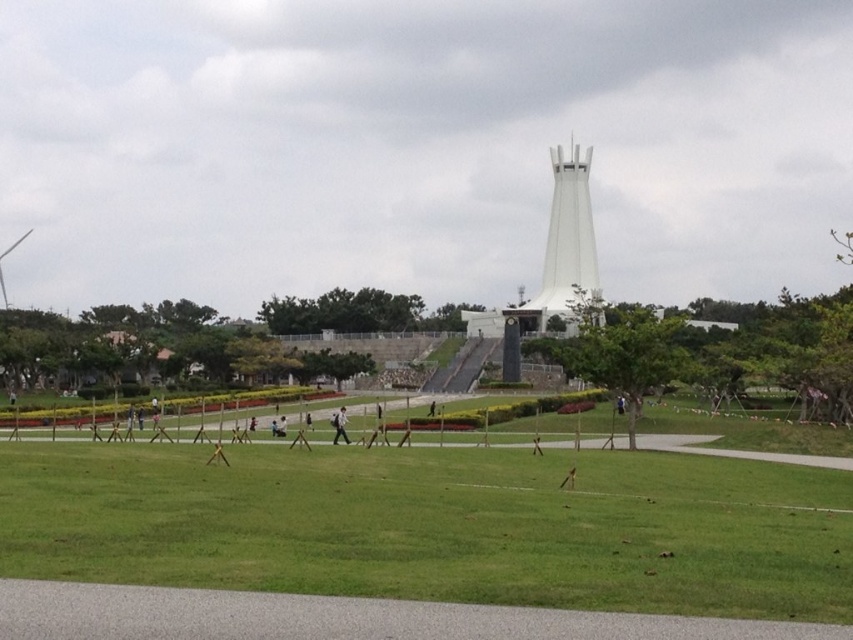
You are standing at the viewpoint of the image and see two points marked as point 1 at coordinates (801, 593) and point 2 at coordinates (341, 426). Which point is nearer to you?

Point 1 at coordinates (801, 593) is closer to the camera than point 2 at coordinates (341, 426), so the nearer point is point 1 at coordinates (801, 593).

You are standing in the park and see the white glossy tower at center and the white fabric person at center. Which one is positioned to the right of the other?

The white glossy tower at center is positioned to the right of the white fabric person at center.